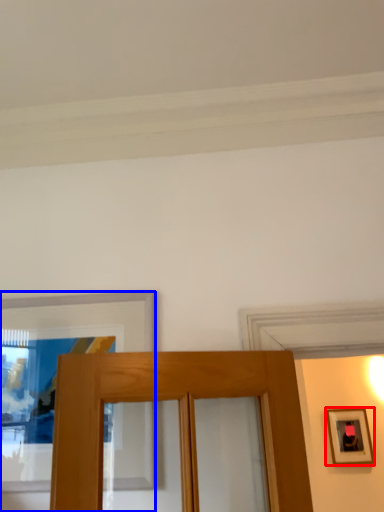
Question: Which object is closer to the camera taking this photo, picture frame (highlighted by a red box) or picture frame (highlighted by a blue box)?

Choices:
 (A) picture frame
 (B) picture frame

Answer: (B)